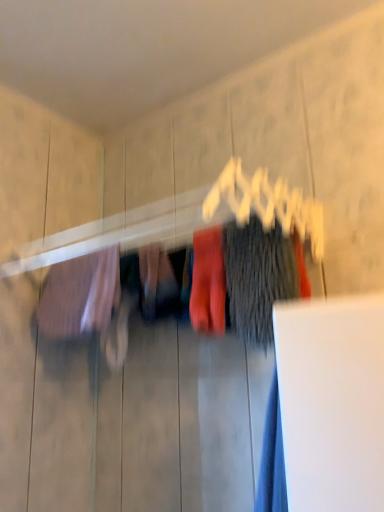
Question: Is matte red socks at center, which is the 2th clothing from right to left, facing away from dark gray fuzzy sweater at center, placed as the 3th clothing when sorted from left to right?

Choices:
 (A) yes
 (B) no

Answer: (B)

Question: Considering the relative positions of matte red socks at center, which is the 2th clothing from right to left, and dark gray fuzzy sweater at center, acting as the 1th clothing starting from the right, in the image provided, is matte red socks at center, which is the 2th clothing from right to left, to the left of dark gray fuzzy sweater at center, acting as the 1th clothing starting from the right, from the viewer's perspective?

Choices:
 (A) no
 (B) yes

Answer: (B)

Question: Is matte red socks at center, which is the 2th clothing from right to left, completely or partially outside of dark gray fuzzy sweater at center, acting as the 1th clothing starting from the right?

Choices:
 (A) yes
 (B) no

Answer: (A)

Question: Considering the relative sizes of matte red socks at center, which is the 2th clothing from right to left, and dark gray fuzzy sweater at center, placed as the 3th clothing when sorted from left to right, in the image provided, is matte red socks at center, which is the 2th clothing from right to left, wider than dark gray fuzzy sweater at center, placed as the 3th clothing when sorted from left to right,?

Choices:
 (A) no
 (B) yes

Answer: (B)

Question: Would you say matte red socks at center, the 2th clothing in the left-to-right sequence, contains dark gray fuzzy sweater at center, placed as the 3th clothing when sorted from left to right?

Choices:
 (A) yes
 (B) no

Answer: (B)

Question: In the image, is matte red socks at center, which is the 2th clothing from right to left, positioned in front of or behind dark gray fuzzy sweater at center, placed as the 3th clothing when sorted from left to right?

Choices:
 (A) behind
 (B) front

Answer: (A)

Question: Considering the positions of matte red socks at center, which is the 2th clothing from right to left, and dark gray fuzzy sweater at center, placed as the 3th clothing when sorted from left to right, in the image, is matte red socks at center, which is the 2th clothing from right to left, bigger or smaller than dark gray fuzzy sweater at center, placed as the 3th clothing when sorted from left to right,?

Choices:
 (A) big
 (B) small

Answer: (B)

Question: Considering the relative positions of matte red socks at center, which is the 2th clothing from right to left, and dark gray fuzzy sweater at center, placed as the 3th clothing when sorted from left to right, in the image provided, is matte red socks at center, which is the 2th clothing from right to left, to the left or to the right of dark gray fuzzy sweater at center, placed as the 3th clothing when sorted from left to right,?

Choices:
 (A) left
 (B) right

Answer: (A)

Question: Does point (215, 292) appear closer or farther from the camera than point (241, 308)?

Choices:
 (A) farther
 (B) closer

Answer: (A)

Question: Does point 259,244 appear closer or farther from the camera than point 215,267?

Choices:
 (A) farther
 (B) closer

Answer: (B)

Question: Is dark gray fuzzy sweater at center, placed as the 3th clothing when sorted from left to right, bigger or smaller than matte red socks at center, which is the 2th clothing from right to left?

Choices:
 (A) big
 (B) small

Answer: (A)

Question: Is dark gray fuzzy sweater at center, placed as the 3th clothing when sorted from left to right, in front of or behind matte red socks at center, the 2th clothing in the left-to-right sequence, in the image?

Choices:
 (A) front
 (B) behind

Answer: (A)

Question: From the image's perspective, is dark gray fuzzy sweater at center, placed as the 3th clothing when sorted from left to right, located above or below matte red socks at center, which is the 2th clothing from right to left?

Choices:
 (A) above
 (B) below

Answer: (A)

Question: Looking at their shapes, would you say matte pink fabric at left, which is the third clothing in right-to-left order, is wider or thinner than matte red socks at center, the 2th clothing in the left-to-right sequence?

Choices:
 (A) wide
 (B) thin

Answer: (A)

Question: Based on their sizes in the image, would you say matte pink fabric at left, which is the third clothing in right-to-left order, is bigger or smaller than matte red socks at center, the 2th clothing in the left-to-right sequence?

Choices:
 (A) small
 (B) big

Answer: (B)